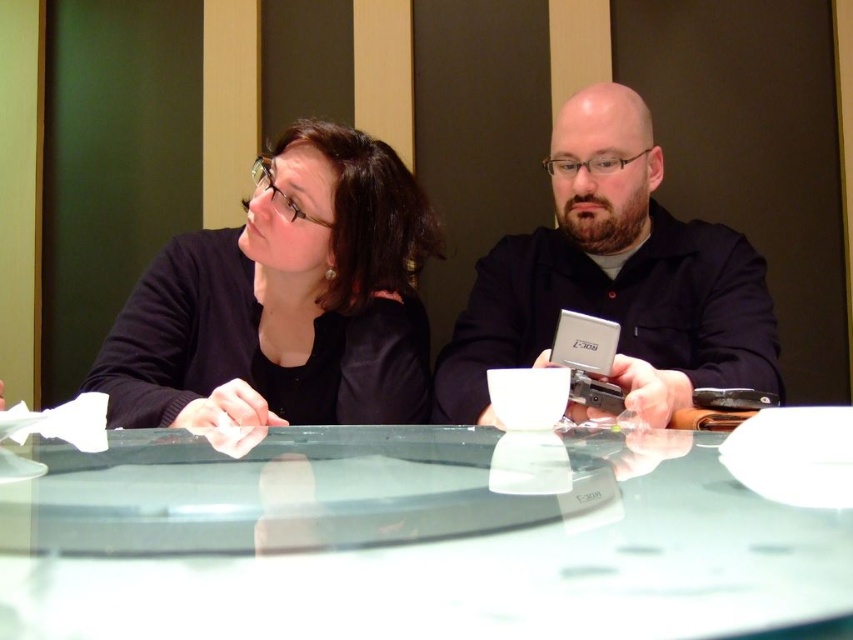
Question: Which object appears closest to the camera in this image?

Choices:
 (A) transparent glass table at center
 (B) black matte sweater at upper left

Answer: (A)

Question: Among these objects, which one is farthest from the camera?

Choices:
 (A) matte black shirt at center
 (B) black matte sweater at upper left
 (C) transparent glass table at center

Answer: (B)

Question: Does black matte sweater at upper left appear over black matte laptop at center?

Choices:
 (A) yes
 (B) no

Answer: (A)

Question: Can you confirm if transparent glass table at center is bigger than black matte sweater at upper left?

Choices:
 (A) no
 (B) yes

Answer: (A)

Question: Can you confirm if black matte sweater at upper left is positioned to the left of matte black shirt at center?

Choices:
 (A) yes
 (B) no

Answer: (A)

Question: Which object appears farthest from the camera in this image?

Choices:
 (A) matte black shirt at center
 (B) black matte sweater at upper left
 (C) transparent glass table at center

Answer: (B)